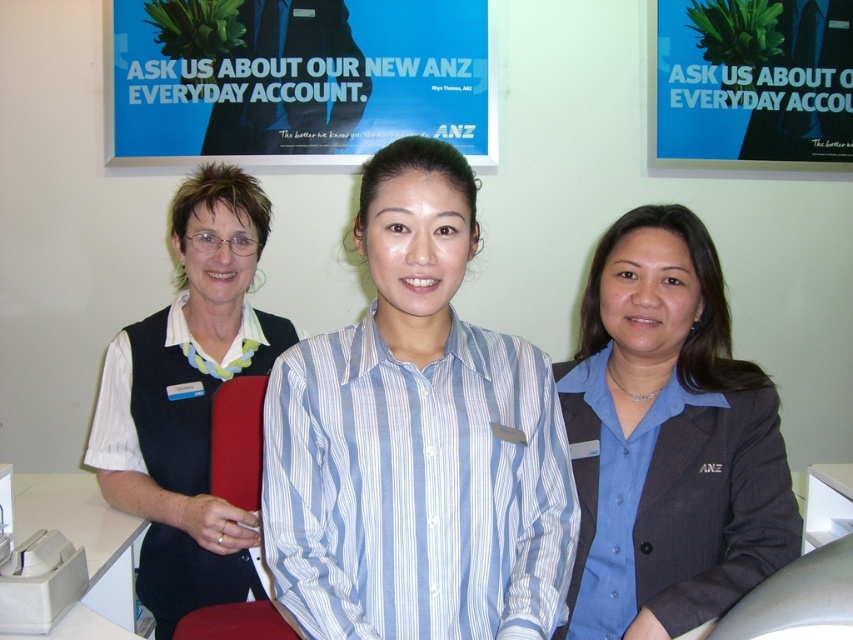
Question: Which is farther from the matte black vest at left?

Choices:
 (A) blue paper at upper center
 (B) blue textured blazer at center

Answer: (A)

Question: Which of these objects is positioned closest to the blue paper at upper center?

Choices:
 (A) white plastic table at center
 (B) blue paper poster at upper center
 (C) matte black vest at left
 (D) blue striped shirt at center

Answer: (B)

Question: Does matte black vest at left come in front of blue paper at upper center?

Choices:
 (A) no
 (B) yes

Answer: (B)

Question: Observing the image, what is the correct spatial positioning of blue striped shirt at center in reference to white plastic table at lower left?

Choices:
 (A) below
 (B) above

Answer: (B)

Question: Estimate the real-world distances between objects in this image. Which object is farther from the blue paper at upper center?

Choices:
 (A) white plastic table at center
 (B) white plastic table at lower left
 (C) matte black vest at left

Answer: (B)

Question: Is blue textured blazer at center bigger than white plastic table at center?

Choices:
 (A) yes
 (B) no

Answer: (A)